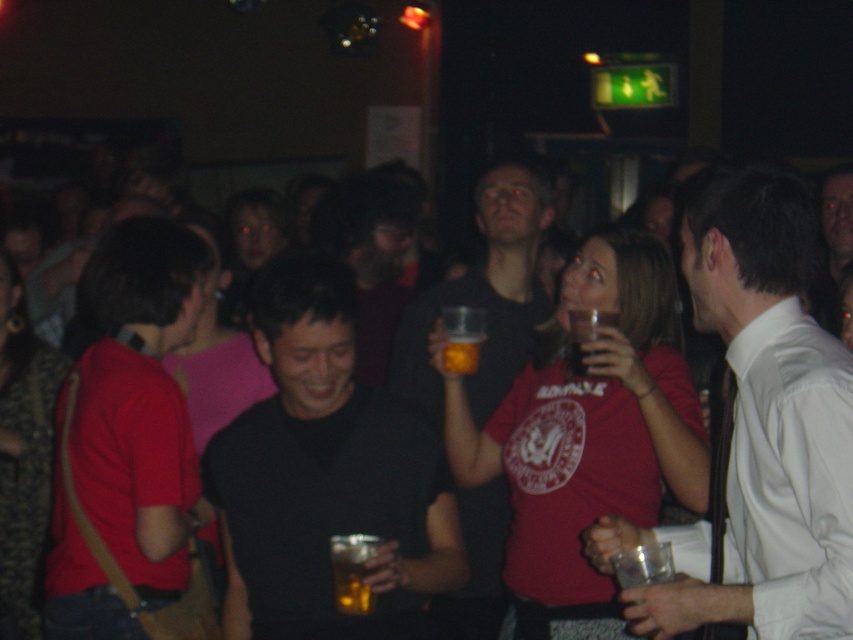
Question: Which object is the farthest from the translucent amber liquid at center?

Choices:
 (A) white shirt at center
 (B) matte black shirt at center

Answer: (B)

Question: Which point is farther from the camera taking this photo?

Choices:
 (A) (316, 576)
 (B) (358, 604)
 (C) (463, 344)

Answer: (C)

Question: Can you confirm if translucent amber liquid at center is positioned to the left of translucent glass beer at center?

Choices:
 (A) no
 (B) yes

Answer: (B)

Question: Does white shirt at center appear under black matte shirt at center?

Choices:
 (A) no
 (B) yes

Answer: (A)

Question: Does black matte shirt at center appear over translucent amber liquid at center?

Choices:
 (A) no
 (B) yes

Answer: (B)

Question: Which is nearer to the black matte shirt at center?

Choices:
 (A) translucent amber liquid at center
 (B) translucent plastic cup at upper center
 (C) translucent glass beer at center
 (D) white shirt at center

Answer: (A)